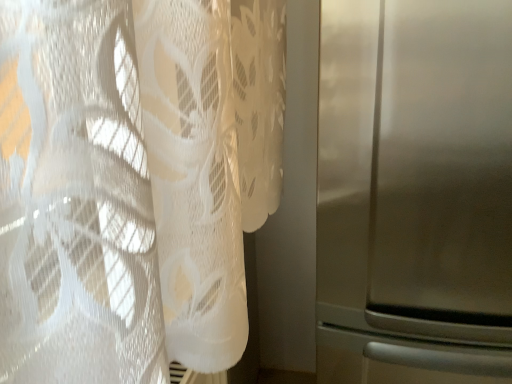
Image resolution: width=512 pixels, height=384 pixels. In order to click on stainless steel refrigerator at right in this screenshot , I will do `click(415, 192)`.

The width and height of the screenshot is (512, 384). What do you see at coordinates (415, 192) in the screenshot?
I see `stainless steel refrigerator at right` at bounding box center [415, 192].

Find the location of a particular element. The width and height of the screenshot is (512, 384). stainless steel refrigerator at right is located at coordinates (415, 192).